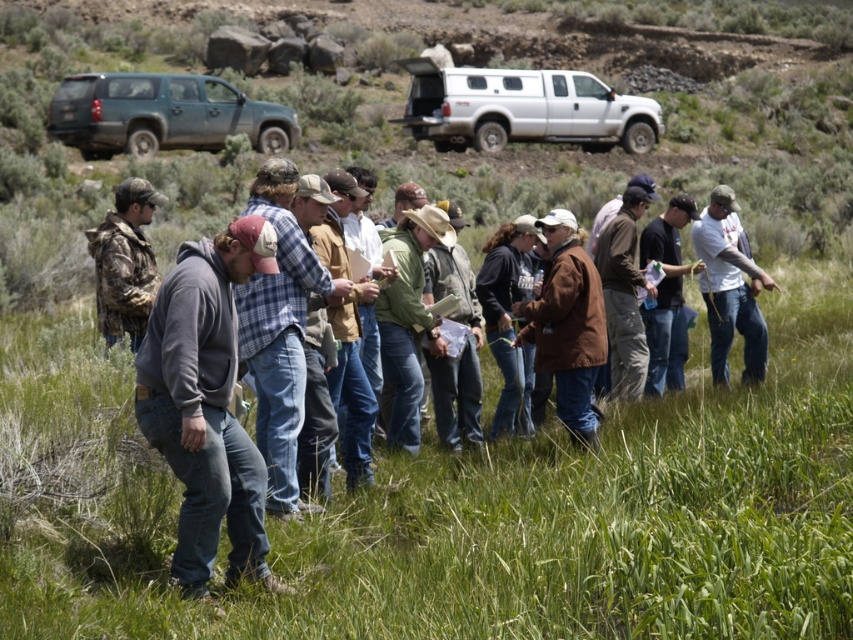
Between white t-shirt at center and brown corduroy jacket at center, which one has more height?

brown corduroy jacket at center is taller.

Can you confirm if white t-shirt at center is positioned to the left of brown corduroy jacket at center?

In fact, white t-shirt at center is to the right of brown corduroy jacket at center.

Locate an element on the screen. white t-shirt at center is located at coordinates (729, 289).

Between brown leather jacket at center and black cotton shirt at center, which one appears on the left side from the viewer's perspective?

brown leather jacket at center is more to the left.

At what (x,y) coordinates should I click in order to perform the action: click on brown leather jacket at center. Please return your answer as a coordinate pair (x, y). Image resolution: width=853 pixels, height=640 pixels. Looking at the image, I should click on (567, 324).

Does point (579, 429) come behind point (670, 209)?

That is False.

Where is `brown leather jacket at center`? This screenshot has width=853, height=640. brown leather jacket at center is located at coordinates (567, 324).

Does gray fleece jacket at center have a lesser width compared to blue plaid shirt at center?

Incorrect, gray fleece jacket at center's width is not less than blue plaid shirt at center's.

Can you confirm if gray fleece jacket at center is smaller than blue plaid shirt at center?

Indeed, gray fleece jacket at center has a smaller size compared to blue plaid shirt at center.

Between point (254, 524) and point (294, 170), which one is positioned in front?

Point (254, 524) is more forward.

Locate an element on the screen. The image size is (853, 640). gray fleece jacket at center is located at coordinates (206, 404).